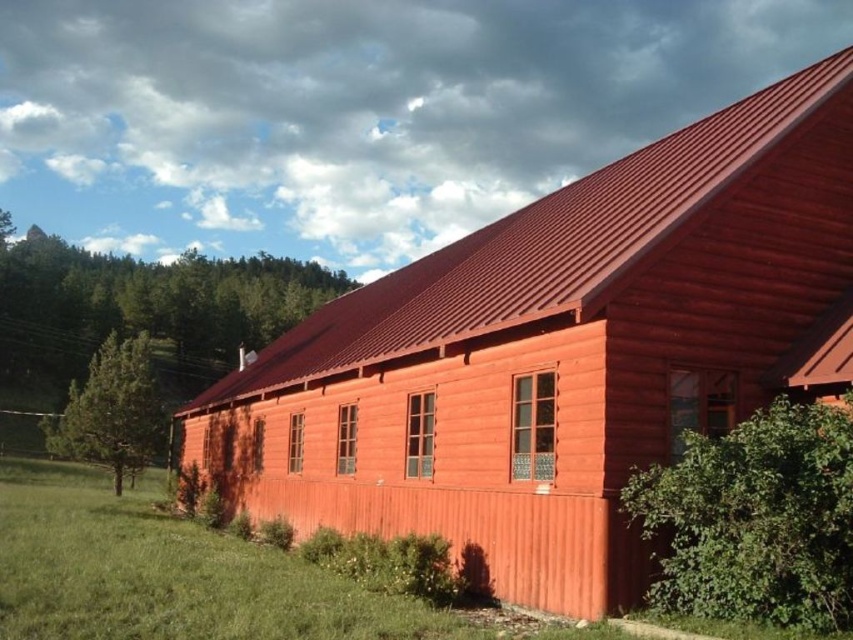
Between point (645, 195) and point (68, 266), which one is positioned behind?

Point (68, 266)

This screenshot has width=853, height=640. Identify the location of metallic red roof at upper center. (538, 248).

At what (x,y) coordinates should I click in order to perform the action: click on metallic red roof at upper center. Please return your answer as a coordinate pair (x, y). Looking at the image, I should click on (538, 248).

Who is more forward, (x=4, y=348) or (x=125, y=346)?

Point (x=125, y=346)

Between green leafy tree at upper left and green textured pine tree at left, which one appears on the left side from the viewer's perspective?

green leafy tree at upper left is more to the left.

Describe the element at coordinates (143, 307) in the screenshot. I see `green leafy tree at upper left` at that location.

At what (x,y) coordinates should I click in order to perform the action: click on green leafy tree at upper left. Please return your answer as a coordinate pair (x, y). Image resolution: width=853 pixels, height=640 pixels. Looking at the image, I should click on (143, 307).

From the picture: Who is taller, metallic red roof at upper center or green textured pine tree at left?

With more height is metallic red roof at upper center.

Between metallic red roof at upper center and green textured pine tree at left, which one appears on the right side from the viewer's perspective?

From the viewer's perspective, metallic red roof at upper center appears more on the right side.

Which is behind, point (610, 216) or point (131, 344)?

Point (131, 344)

The height and width of the screenshot is (640, 853). I want to click on metallic red roof at upper center, so click(x=538, y=248).